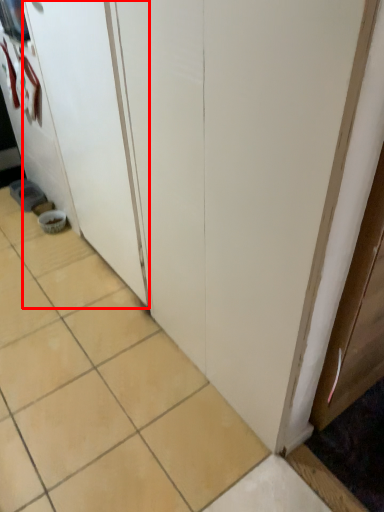
Question: From the image's perspective, what is the correct spatial relationship of screen door (annotated by the red box) in relation to ceramic tile?

Choices:
 (A) below
 (B) above

Answer: (B)